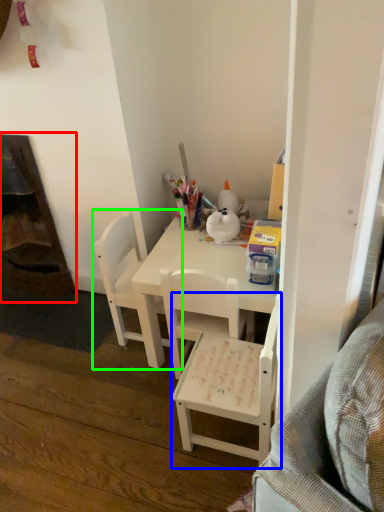
Question: Which is farther away from fireplace (highlighted by a red box)? chair (highlighted by a blue box) or chair (highlighted by a green box)?

Choices:
 (A) chair
 (B) chair

Answer: (A)